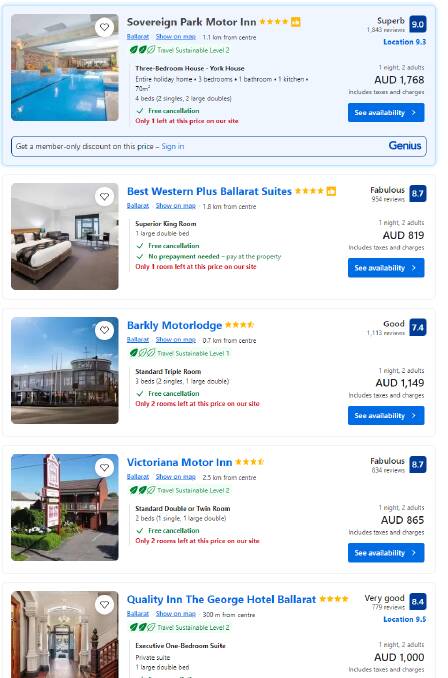
This screenshot has height=678, width=448. Identify the location of stairs. (100, 662).